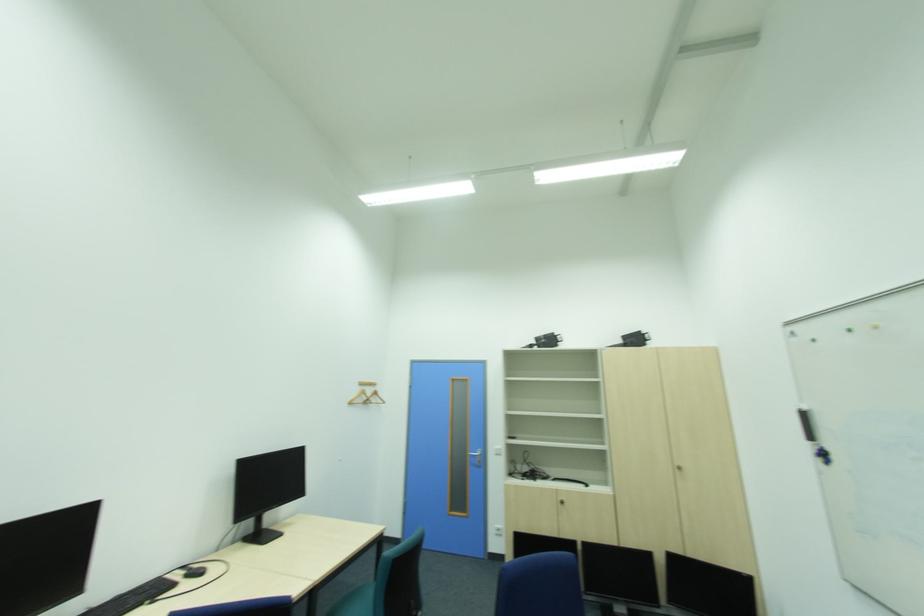
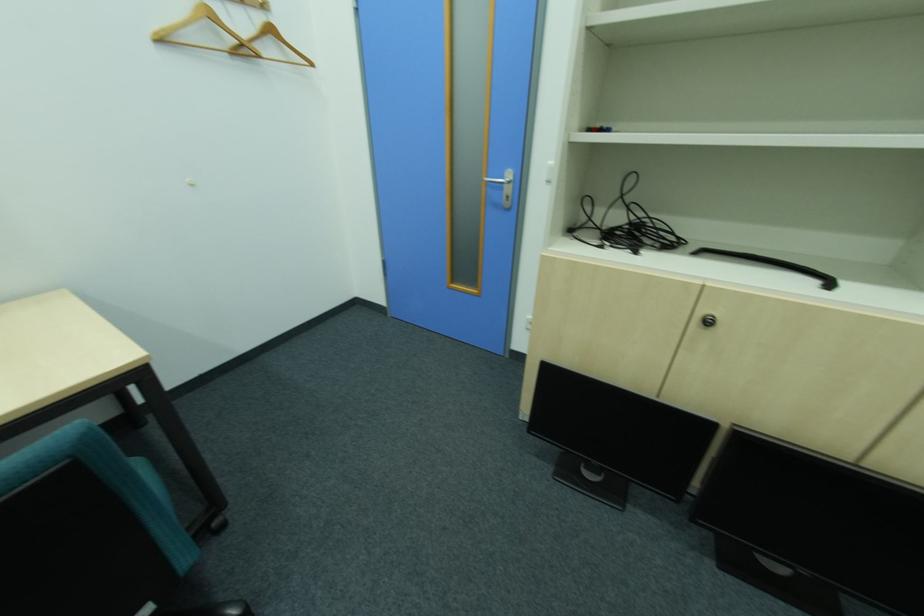
The point at (x=375, y=400) is marked in the first image. Where is the corresponding point in the second image?

(249, 45)